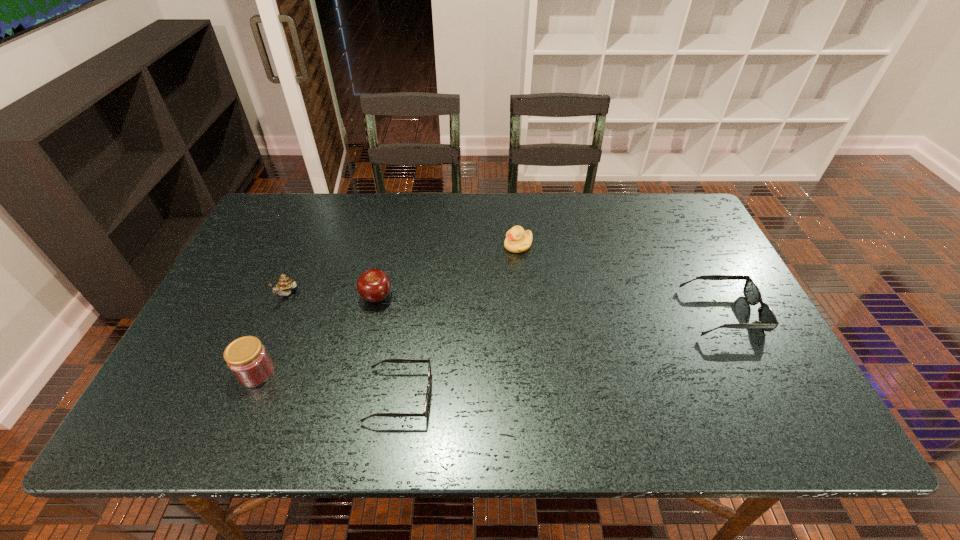
Identify the location of vacant point that satisfies the following two spatial constraints: 1. on the face of the snail; 2. on the left side of the jam. This screenshot has width=960, height=540. (254, 373).

Where is `free spot that satisfies the following two spatial constraints: 1. on the face of the apple; 2. on the left side of the snail`? This screenshot has height=540, width=960. free spot that satisfies the following two spatial constraints: 1. on the face of the apple; 2. on the left side of the snail is located at coordinates (286, 297).

In order to click on vacant area that satisfies the following two spatial constraints: 1. on the face of the apple; 2. on the right side of the snail in this screenshot , I will do `click(286, 297)`.